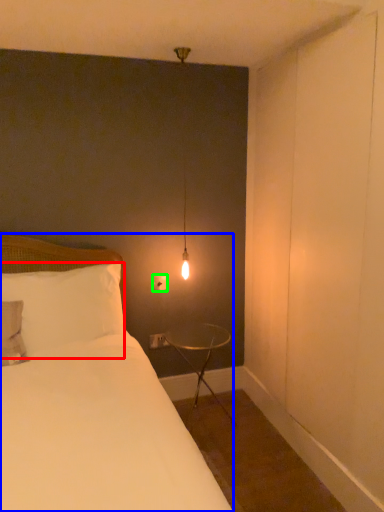
Question: Which object is the farthest from pillow (highlighted by a red box)? Choose among these: bed (highlighted by a blue box) or electric outlet (highlighted by a green box).

Choices:
 (A) bed
 (B) electric outlet

Answer: (B)